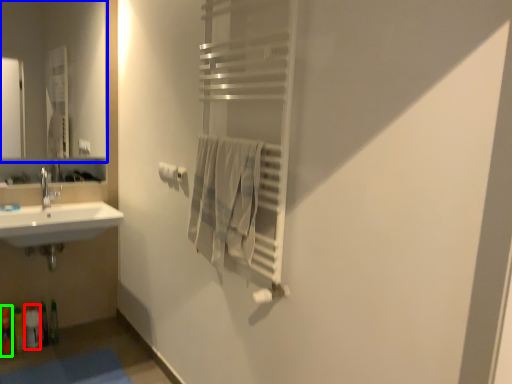
Question: Estimate the real-world distances between objects in this image. Which object is closer to toiletry (highlighted by a red box), mirror (highlighted by a blue box) or toiletry (highlighted by a green box)?

Choices:
 (A) mirror
 (B) toiletry

Answer: (B)